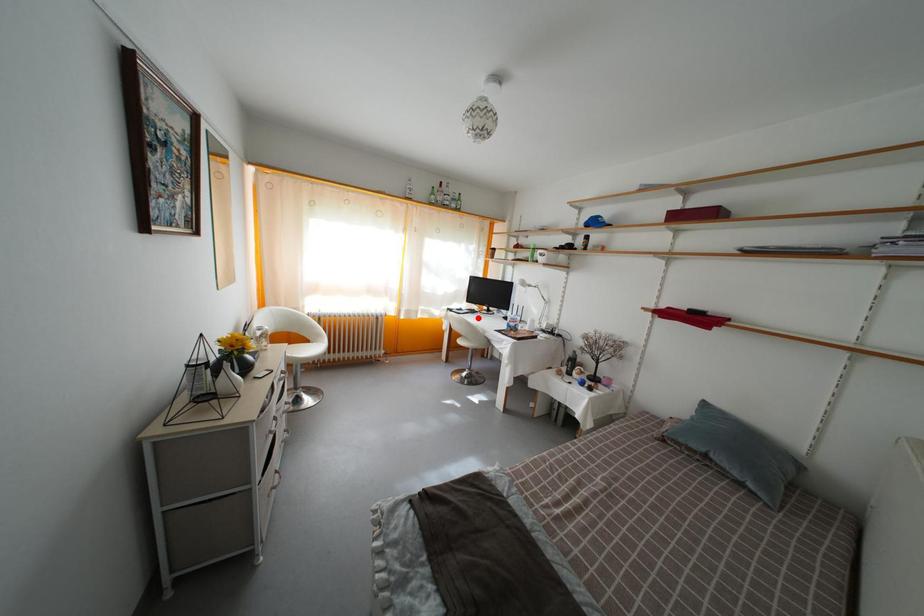
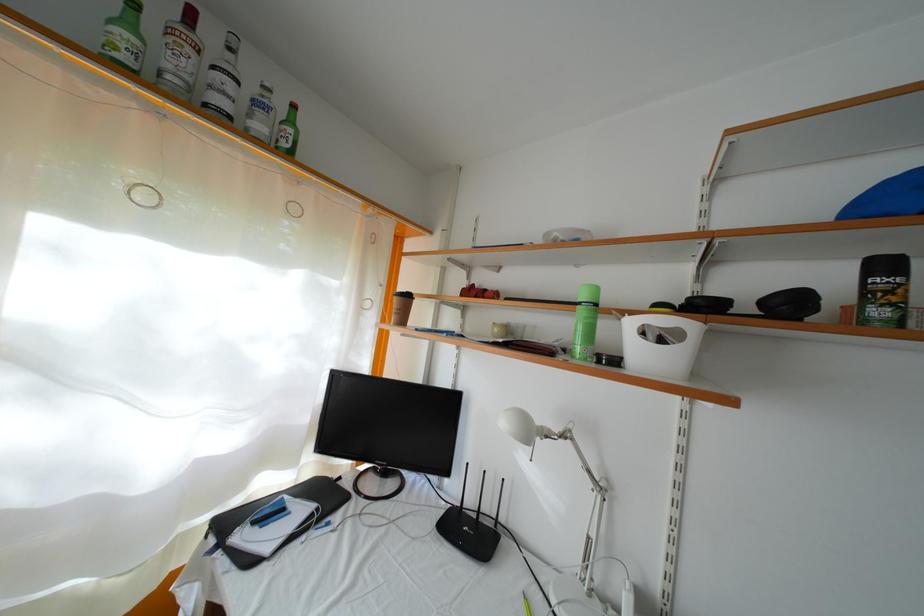
The point at the highlighted location is marked in the first image. Where is the corresponding point in the second image?

(334, 506)